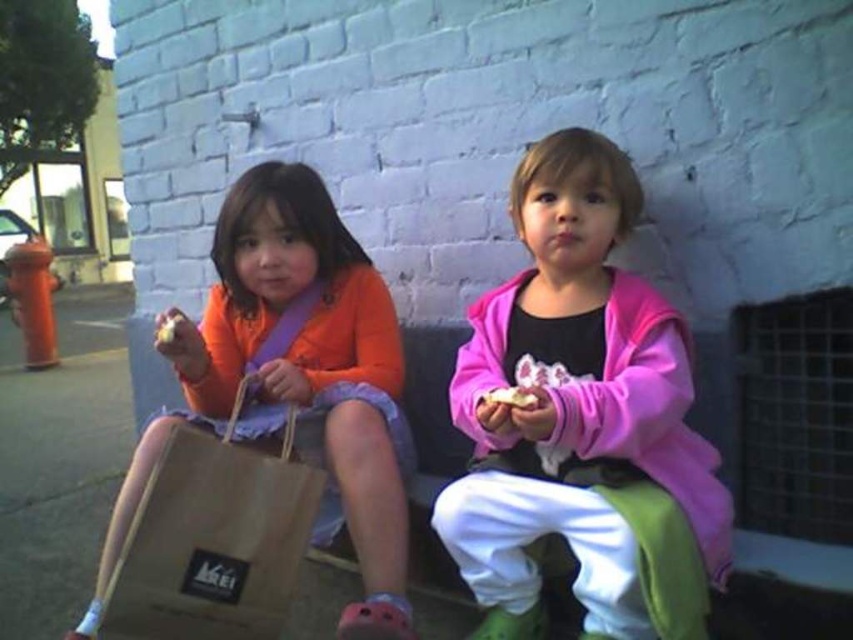
Is pink fleece jacket at center shorter than white crumbly food at center?

No, pink fleece jacket at center is not shorter than white crumbly food at center.

Does pink fleece jacket at center have a larger size compared to white crumbly food at center?

Indeed, pink fleece jacket at center has a larger size compared to white crumbly food at center.

I want to click on pink fleece jacket at center, so coord(583,420).

This screenshot has width=853, height=640. I want to click on matte brown paper bag at left, so click(294, 374).

Does matte brown paper bag at left appear over white crumbly bread at center?

No.

Describe the element at coordinates (294, 374) in the screenshot. This screenshot has width=853, height=640. I see `matte brown paper bag at left` at that location.

I want to click on matte brown paper bag at left, so click(x=294, y=374).

Who is positioned more to the left, matte brown paper bag at left or brown paper bag at left?

matte brown paper bag at left

Is matte brown paper bag at left positioned behind brown paper bag at left?

Yes.

Locate an element on the screen. This screenshot has width=853, height=640. matte brown paper bag at left is located at coordinates (294, 374).